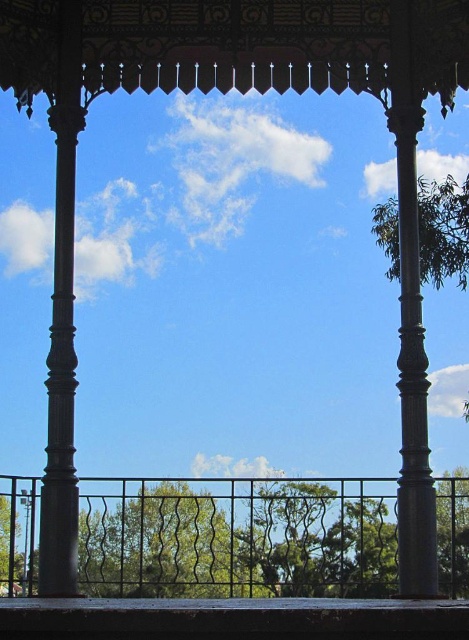
From the picture: You are standing at the entrance of the gazebo and want to take a photo of the green leafy tree at center. Based on its position, where should you aim your camera relative to the gazebo?

The green leafy tree at center is located at point coordinates, so you should aim your camera towards the center of the gazebo to capture it.

You are standing in the gazebo and want to take a photo of the metallic silver pole at lower left and the green leafy tree at center. Which object should you frame first in your camera to capture both in the same shot?

The metallic silver pole at lower left should be framed first because the green leafy tree at center is positioned to its right, so adjusting the camera to include both would require starting with the pole on the left side of the frame.